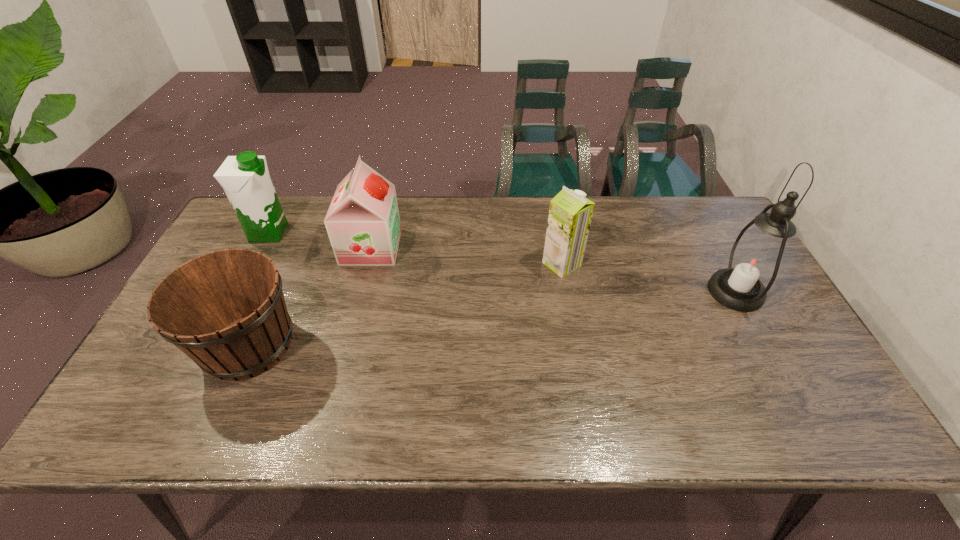
The image size is (960, 540). What are the coordinates of `vacant space situated on the right of the shortest object` in the screenshot? It's located at (399, 344).

Locate an element on the screen. soya milk present at the left edge is located at coordinates (245, 178).

The width and height of the screenshot is (960, 540). Find the location of `wine bucket at the left edge`. wine bucket at the left edge is located at coordinates (225, 310).

At what (x,y) coordinates should I click in order to perform the action: click on object that is at the right edge. Please return your answer as a coordinate pair (x, y). The image size is (960, 540). Looking at the image, I should click on coord(755,261).

The height and width of the screenshot is (540, 960). Find the location of `object present at the far left corner`. object present at the far left corner is located at coordinates (245, 178).

I want to click on vacant space at the far edge, so click(612, 222).

In the image, there is a desktop. What are the coordinates of `vacant space at the near edge` in the screenshot? It's located at (558, 414).

This screenshot has height=540, width=960. Identify the location of vacant space at the left edge of the desktop. point(140,381).

In the image, there is a desktop. Where is `free space at the right edge`? This screenshot has width=960, height=540. free space at the right edge is located at coordinates 690,245.

In order to click on free space at the far right corner of the desktop in this screenshot , I will do `click(709, 211)`.